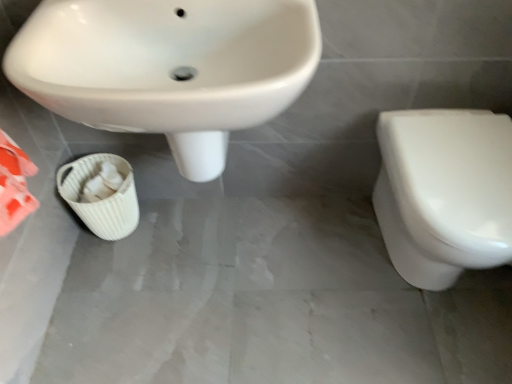
This screenshot has height=384, width=512. I want to click on free spot in front of white glossy toilet at right, so click(429, 352).